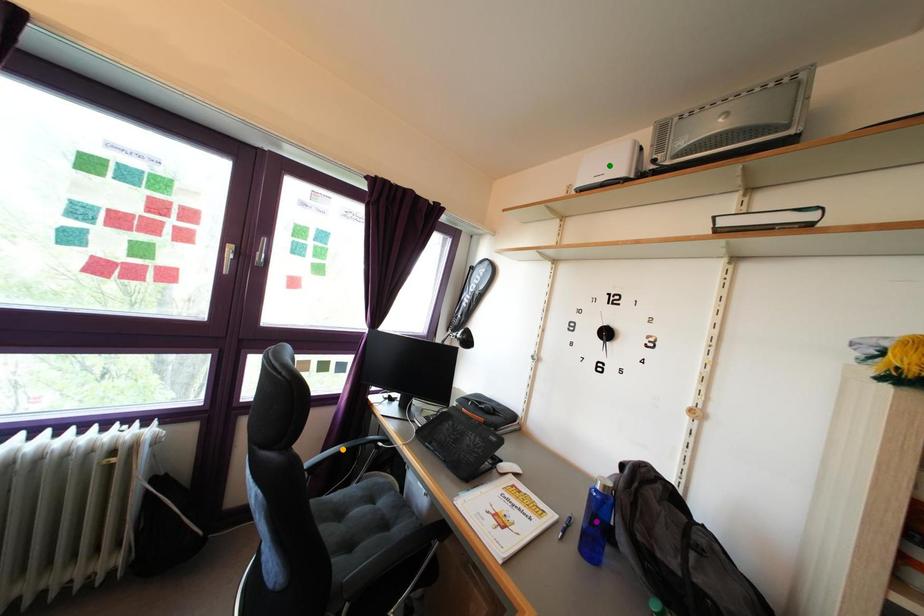
Order these from nearest to farthest:
- green point
- purple point
- orange point

purple point → green point → orange point